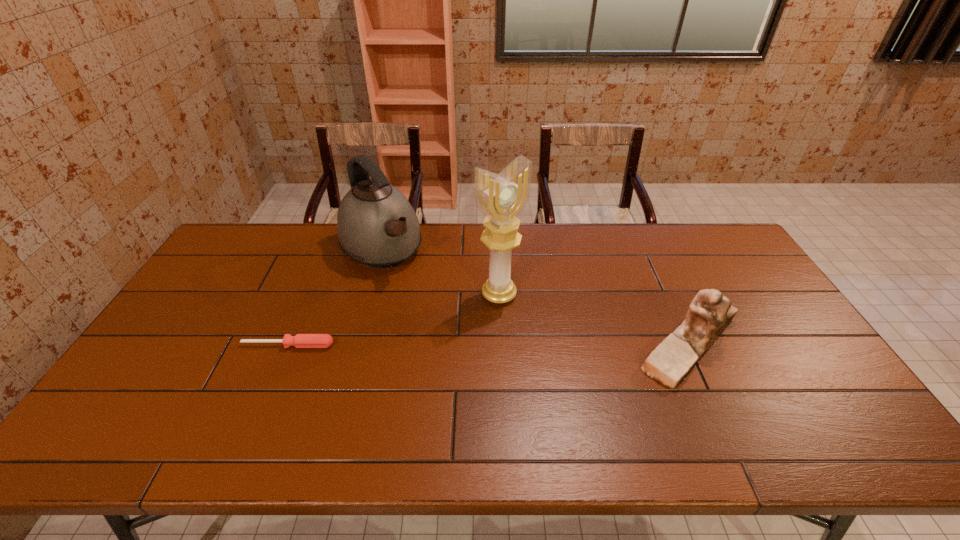
Identify the location of free space between the third shortest object and the award. This screenshot has height=540, width=960. (441, 272).

Find the location of `vacant area between the screwdriver and the farthest object`. vacant area between the screwdriver and the farthest object is located at coordinates (335, 298).

You are a GUI agent. You are given a task and a screenshot of the screen. Output one action in this format:
    pyautogui.click(x=<x>, y=<y>)
    Task: Click on the empty space between the second object from right to left and the shortest object
    
    Given the screenshot: What is the action you would take?
    pyautogui.click(x=394, y=320)

Identify the location of vacant space that is in between the kettle and the screwdriver. (335, 298).

Identify the location of object that stands as the third closest to the shortest object. This screenshot has height=540, width=960. (710, 312).

Locate an element on the screen. the closest object relative to the tallest object is located at coordinates (376, 225).

Where is `vacant position in the image that satisfies the following two spatial constraints: 1. on the front side of the rightmost object; 2. on the front-facing side of the second object from right to left`? The width and height of the screenshot is (960, 540). vacant position in the image that satisfies the following two spatial constraints: 1. on the front side of the rightmost object; 2. on the front-facing side of the second object from right to left is located at coordinates (501, 345).

I want to click on free spot that satisfies the following two spatial constraints: 1. on the front side of the figurine; 2. on the front-facing side of the second object from right to left, so click(x=501, y=345).

You are a GUI agent. You are given a task and a screenshot of the screen. Output one action in this format:
    pyautogui.click(x=<x>, y=<y>)
    Task: Click on the free point that satisfies the following two spatial constraints: 1. on the front side of the kettle; 2. on the front-facing side of the rightmost object
    The height and width of the screenshot is (540, 960).
    Given the screenshot: What is the action you would take?
    pyautogui.click(x=355, y=345)